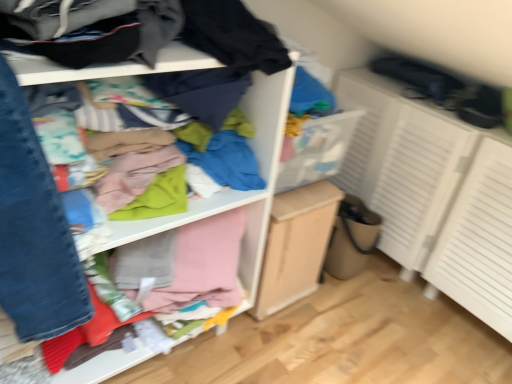
Question: Can you confirm if white textured cabinet at right is shorter than light wood/file cabinet at center?

Choices:
 (A) yes
 (B) no

Answer: (B)

Question: From the image's perspective, is white textured cabinet at right on top of light wood/file cabinet at center?

Choices:
 (A) no
 (B) yes

Answer: (B)

Question: Is white textured cabinet at right far from light wood/file cabinet at center?

Choices:
 (A) yes
 (B) no

Answer: (B)

Question: Can you confirm if white textured cabinet at right is taller than light wood/file cabinet at center?

Choices:
 (A) yes
 (B) no

Answer: (A)

Question: Is white textured cabinet at right thinner than light wood/file cabinet at center?

Choices:
 (A) yes
 (B) no

Answer: (B)

Question: Does point (501, 288) appear closer or farther from the camera than point (1, 309)?

Choices:
 (A) farther
 (B) closer

Answer: (A)

Question: Choose the correct answer: Is white textured cabinet at right inside cloth at upper left or outside it?

Choices:
 (A) inside
 (B) outside

Answer: (B)

Question: Is white textured cabinet at right taller or shorter than cloth at upper left?

Choices:
 (A) short
 (B) tall

Answer: (A)

Question: From the image's perspective, is white textured cabinet at right positioned above or below cloth at upper left?

Choices:
 (A) above
 (B) below

Answer: (A)

Question: In terms of height, does white textured cabinet at right look taller or shorter compared to light wood/file cabinet at center?

Choices:
 (A) short
 (B) tall

Answer: (B)

Question: In terms of size, does white textured cabinet at right appear bigger or smaller than light wood/file cabinet at center?

Choices:
 (A) big
 (B) small

Answer: (A)

Question: Considering the positions of point (471, 246) and point (282, 297), is point (471, 246) closer or farther from the camera than point (282, 297)?

Choices:
 (A) closer
 (B) farther

Answer: (A)

Question: In terms of width, does white textured cabinet at right look wider or thinner when compared to light wood/file cabinet at center?

Choices:
 (A) wide
 (B) thin

Answer: (A)

Question: Does point (278, 301) appear closer or farther from the camera than point (424, 175)?

Choices:
 (A) farther
 (B) closer

Answer: (B)

Question: Would you say light wood/file cabinet at center is inside or outside white textured cabinet at right?

Choices:
 (A) inside
 (B) outside

Answer: (B)